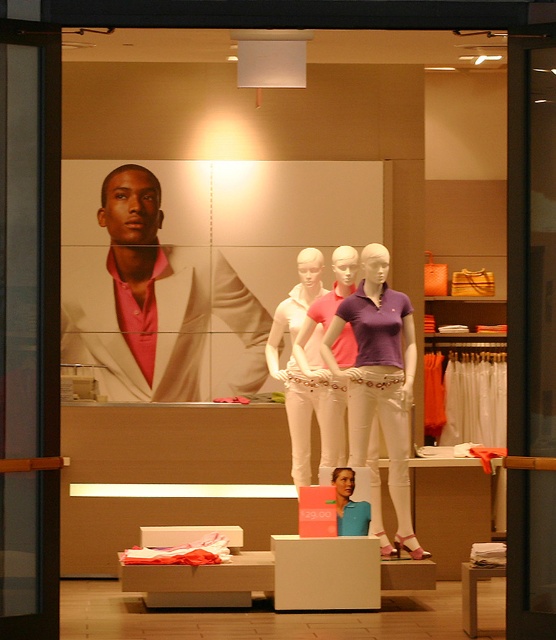
You are a customer standing in front of the store window. You want to buy the purple cotton polo shirt at center. Where exactly should you look in the window display?

The purple cotton polo shirt at center is located at point coordinates of 0.592 on the x axis and 0.683 on the y axis.

You are standing in front of the retail store window. There are two points marked on the window display. The first point is at coordinates point [398,416] and the second at point [327,452]. Which point is closer to you, the observer?

Point [398,416] is in front of point [327,452], so it is closer to you.

What is the object located at point (153, 301) in the retail store window display?

The object located at point (153, 301) is the matte white suit at center.